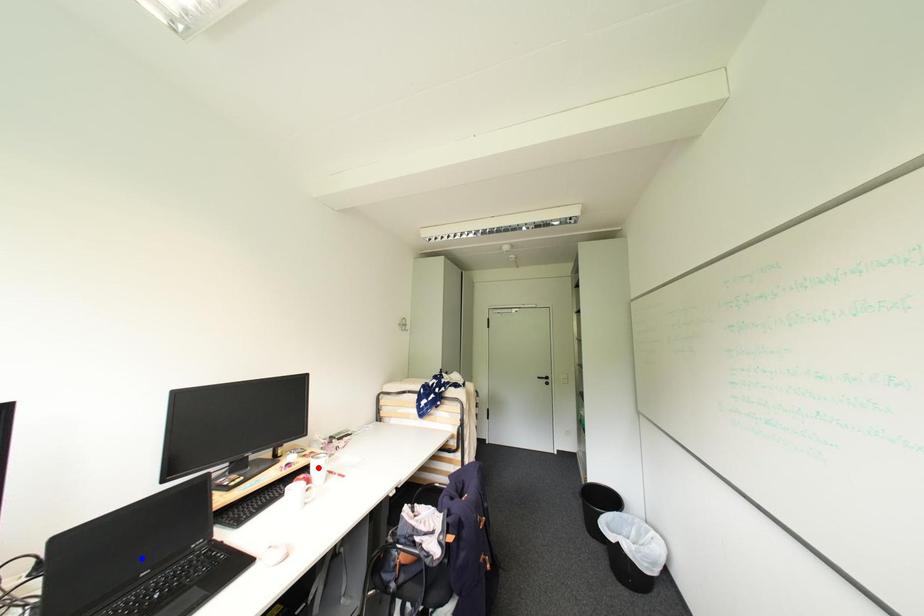
Question: In the image, two points are highlighted. Which point is nearer to the camera? Reply with the corresponding letter.

Choices:
 (A) blue point
 (B) red point

Answer: (A)